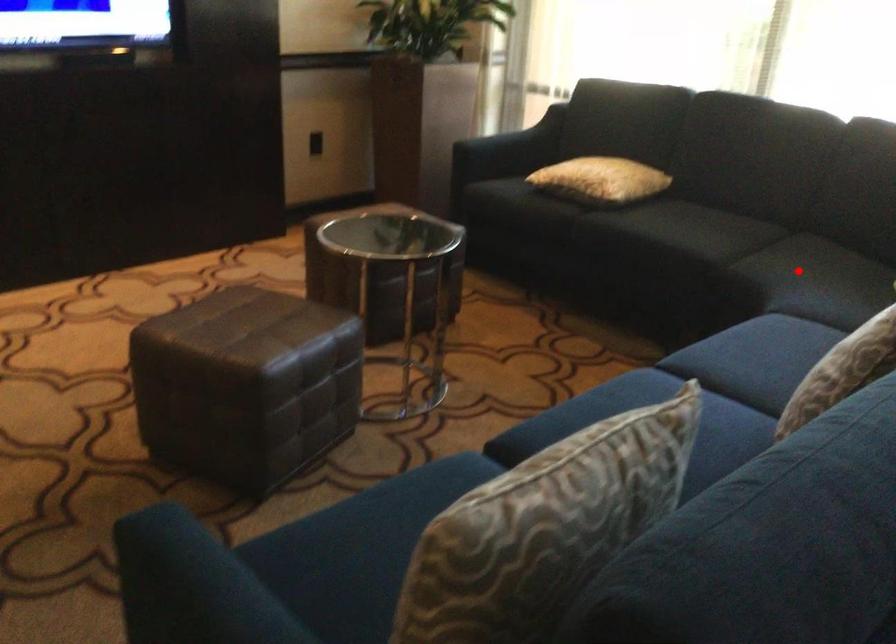
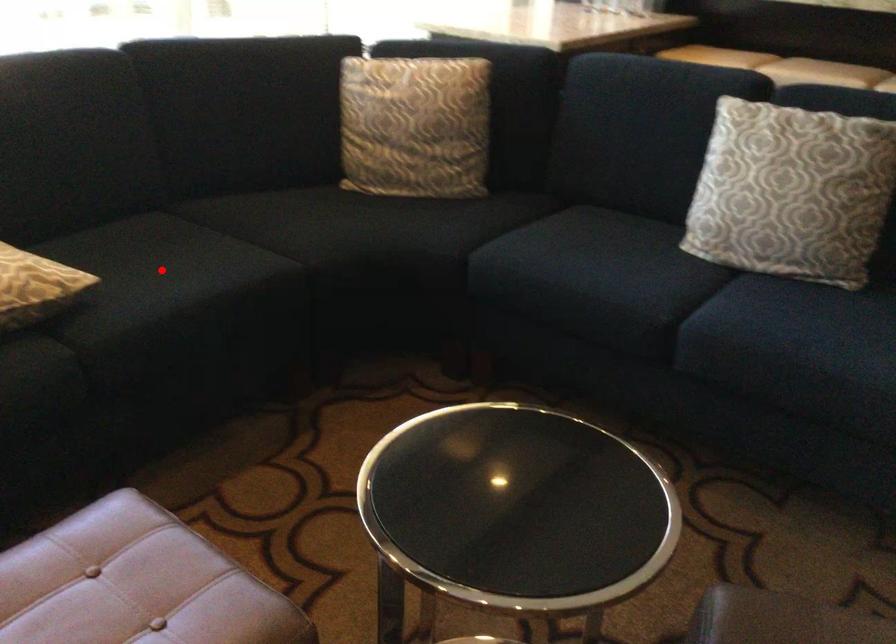
I am providing you with two images of the same scene from different viewpoints. A red point is marked on the first image and another point is marked on the second image. Is the marked point in image1 the same physical position as the marked point in image2?

No